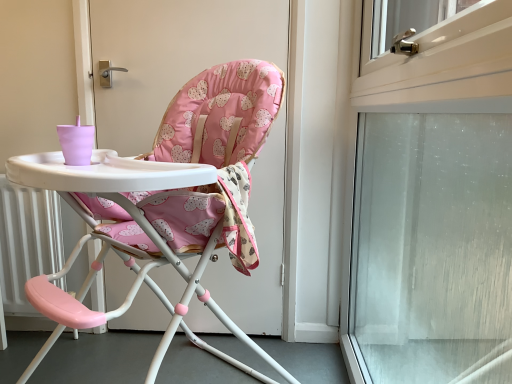
The image size is (512, 384). What are the coordinates of `frosted glass screen door at right` in the screenshot? It's located at (432, 200).

This screenshot has height=384, width=512. Describe the element at coordinates (432, 200) in the screenshot. I see `frosted glass screen door at right` at that location.

What is the approximate height of frosted glass screen door at right?

The height of frosted glass screen door at right is 4.00 feet.

You are a GUI agent. You are given a task and a screenshot of the screen. Output one action in this format:
    pyautogui.click(x=<x>, y=<y>)
    Task: Click on the pink fabric highchair at center
    
    Given the screenshot: What is the action you would take?
    pyautogui.click(x=167, y=203)

Describe the element at coordinates (167, 203) in the screenshot. This screenshot has height=384, width=512. I see `pink fabric highchair at center` at that location.

Locate an element on the screen. This screenshot has height=384, width=512. frosted glass screen door at right is located at coordinates (432, 200).

Which object is positioned more to the left, pink fabric highchair at center or frosted glass screen door at right?

Positioned to the left is pink fabric highchair at center.

In the image, is pink fabric highchair at center positioned in front of or behind frosted glass screen door at right?

Clearly, pink fabric highchair at center is behind frosted glass screen door at right.

Considering the positions of point (137, 166) and point (411, 221), is point (137, 166) closer or farther from the camera than point (411, 221)?

Point (137, 166).

Looking at this image, from the image's perspective, relative to frosted glass screen door at right, is pink fabric highchair at center above or below?

From the image's perspective, pink fabric highchair at center appears below frosted glass screen door at right.

From a real-world perspective, relative to frosted glass screen door at right, is pink fabric highchair at center vertically above or below?

pink fabric highchair at center is situated lower than frosted glass screen door at right in the real world.

Which object is wider, pink fabric highchair at center or frosted glass screen door at right?

pink fabric highchair at center.

Can you confirm if pink fabric highchair at center is taller than frosted glass screen door at right?

In fact, pink fabric highchair at center may be shorter than frosted glass screen door at right.

Looking at the image, does pink fabric highchair at center seem bigger or smaller compared to frosted glass screen door at right?

In the image, pink fabric highchair at center appears to be larger than frosted glass screen door at right.

Would you say pink fabric highchair at center is outside frosted glass screen door at right?

Yes, pink fabric highchair at center is not within frosted glass screen door at right.

Are pink fabric highchair at center and frosted glass screen door at right beside each other?

No, pink fabric highchair at center is not making contact with frosted glass screen door at right.

Could you tell me if pink fabric highchair at center is turned towards frosted glass screen door at right?

No, pink fabric highchair at center is not facing towards frosted glass screen door at right.

How different are the orientations of pink fabric highchair at center and frosted glass screen door at right in degrees?

The angular difference between pink fabric highchair at center and frosted glass screen door at right is 47.5 degrees.

In order to click on chair below the frosted glass screen door at right (from the image's perspective) in this screenshot , I will do coord(167,203).

Considering the relative positions of frosted glass screen door at right and pink fabric highchair at center in the image provided, is frosted glass screen door at right to the left of pink fabric highchair at center from the viewer's perspective?

No.

Considering the positions of objects frosted glass screen door at right and pink fabric highchair at center in the image provided, who is in front, frosted glass screen door at right or pink fabric highchair at center?

frosted glass screen door at right is in front.

Does point (379, 82) come closer to viewer compared to point (192, 145)?

Yes, it is.

From the image's perspective, is frosted glass screen door at right over pink fabric highchair at center?

Correct, frosted glass screen door at right appears higher than pink fabric highchair at center in the image.

Based on the photo, from a real-world perspective, which object rests below the other?

From a 3D spatial view, pink fabric highchair at center is below.

Looking at their sizes, would you say frosted glass screen door at right is wider or thinner than pink fabric highchair at center?

Clearly, frosted glass screen door at right has less width compared to pink fabric highchair at center.

From the picture: Who is taller, frosted glass screen door at right or pink fabric highchair at center?

frosted glass screen door at right is taller.

Between frosted glass screen door at right and pink fabric highchair at center, which one has larger size?

pink fabric highchair at center is bigger.

Would you say pink fabric highchair at center is part of frosted glass screen door at right's contents?

Actually, pink fabric highchair at center is outside frosted glass screen door at right.

Is frosted glass screen door at right next to pink fabric highchair at center and touching it?

frosted glass screen door at right and pink fabric highchair at center are not in contact.

Could you tell me if frosted glass screen door at right is turned towards pink fabric highchair at center?

Yes, frosted glass screen door at right is facing pink fabric highchair at center.

How different are the orientations of frosted glass screen door at right and pink fabric highchair at center in degrees?

There is a 47.5-degree angle between the facing directions of frosted glass screen door at right and pink fabric highchair at center.

Measure the distance from frosted glass screen door at right to pink fabric highchair at center.

A distance of 22.62 inches exists between frosted glass screen door at right and pink fabric highchair at center.

The image size is (512, 384). In the image, there is a pink fabric highchair at center. What are the coordinates of `screen door above it (from the image's perspective)` in the screenshot? It's located at (432, 200).

At what (x,y) coordinates should I click in order to perform the action: click on screen door on the right of pink fabric highchair at center. Please return your answer as a coordinate pair (x, y). Looking at the image, I should click on (432, 200).

Find the location of a particular element. The image size is (512, 384). screen door that appears in front of the pink fabric highchair at center is located at coordinates (432, 200).